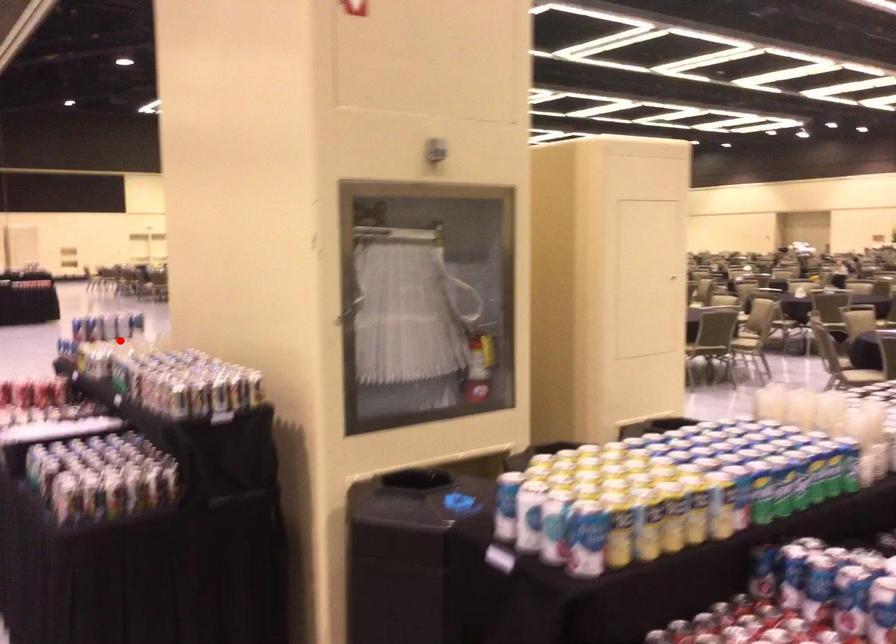
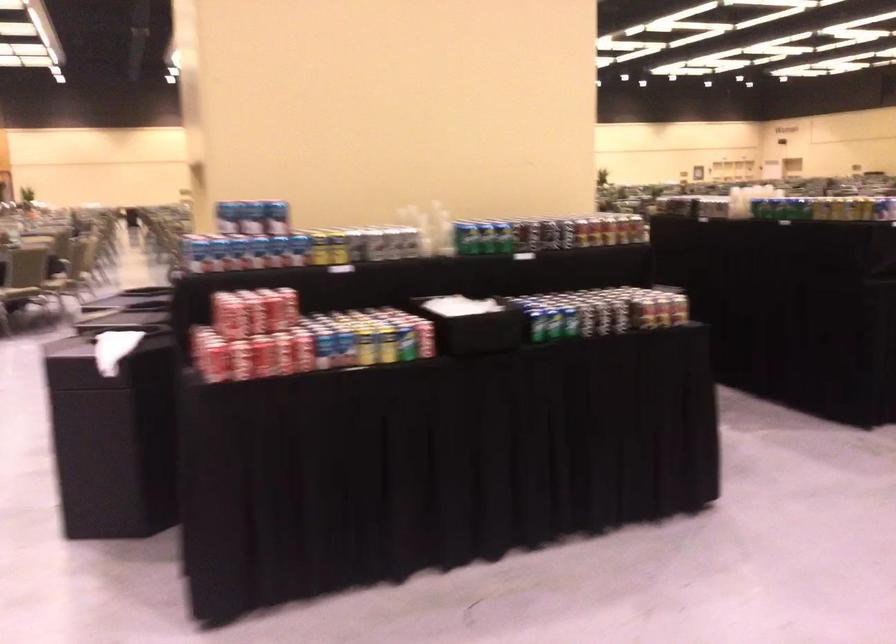
The point at the highlighted location is marked in the first image. Where is the corresponding point in the second image?

(352, 245)